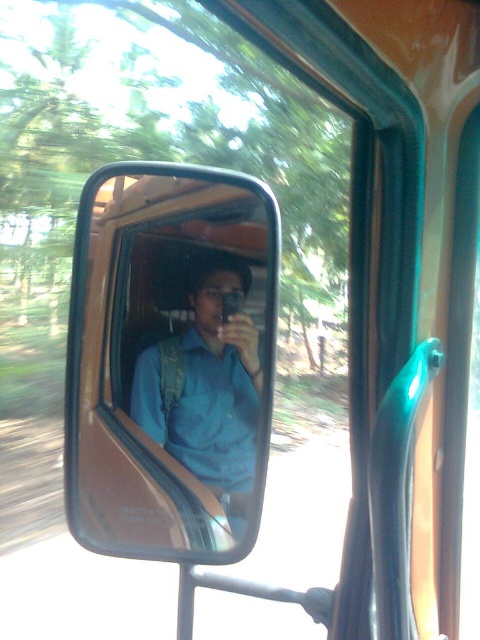
Question: Where is black matte mirror at center located in relation to blue fabric shirt at center in the image?

Choices:
 (A) below
 (B) above

Answer: (B)

Question: Which point is closer to the camera?

Choices:
 (A) (216, 467)
 (B) (154, 294)

Answer: (B)

Question: Which point is closer to the camera?

Choices:
 (A) blue fabric shirt at center
 (B) black matte mirror at center

Answer: (B)

Question: Does black matte mirror at center appear over blue fabric shirt at center?

Choices:
 (A) no
 (B) yes

Answer: (B)

Question: Can you confirm if black matte mirror at center is smaller than blue fabric shirt at center?

Choices:
 (A) no
 (B) yes

Answer: (A)

Question: Which point appears farthest from the camera in this image?

Choices:
 (A) (253, 385)
 (B) (264, 385)

Answer: (A)